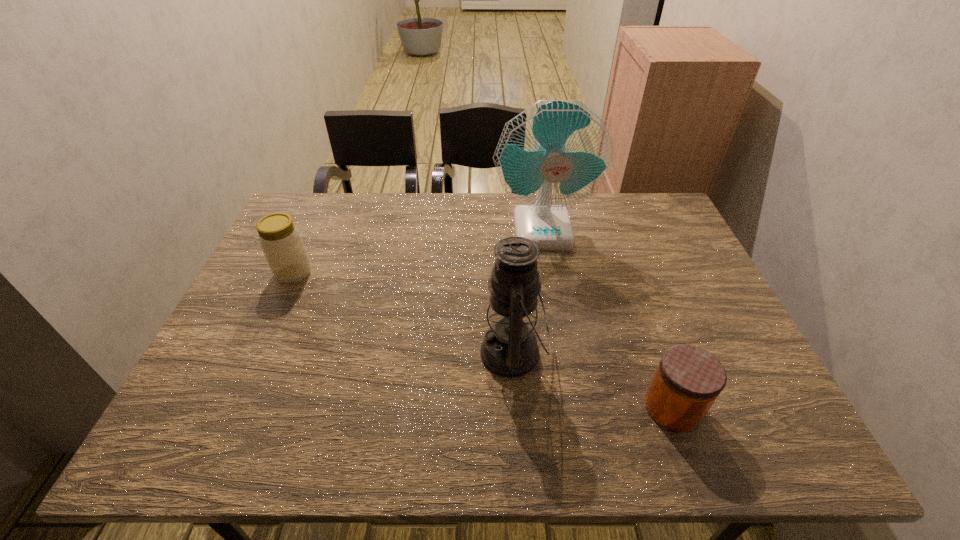
Find the location of a particular element. This screenshot has width=960, height=540. vacant space at the far right corner of the desktop is located at coordinates point(656,193).

You are a GUI agent. You are given a task and a screenshot of the screen. Output one action in this format:
    pyautogui.click(x=<x>, y=<y>)
    Task: Click on the vacant point located between the leftmost object and the oil lamp
    Image resolution: width=960 pixels, height=540 pixels.
    Given the screenshot: What is the action you would take?
    pyautogui.click(x=403, y=313)

The width and height of the screenshot is (960, 540). I want to click on vacant region between the second farthest object and the tallest object, so click(418, 251).

You are a GUI agent. You are given a task and a screenshot of the screen. Output one action in this format:
    pyautogui.click(x=<x>, y=<y>)
    Task: Click on the vacant area between the third tallest object and the third shortest object
    The image size is (960, 540).
    Given the screenshot: What is the action you would take?
    pyautogui.click(x=403, y=313)

Where is `free space between the third tallest object and the fan`? Image resolution: width=960 pixels, height=540 pixels. free space between the third tallest object and the fan is located at coordinates (418, 251).

The height and width of the screenshot is (540, 960). Find the location of `free space between the fan and the third nearest object`. free space between the fan and the third nearest object is located at coordinates (418, 251).

Image resolution: width=960 pixels, height=540 pixels. What are the coordinates of `vacant region between the nearer jar and the farthest object` in the screenshot? It's located at (608, 318).

Where is `object that stands as the closest to the oil lamp`? The height and width of the screenshot is (540, 960). object that stands as the closest to the oil lamp is located at coordinates (688, 380).

The image size is (960, 540). In order to click on the second closest object to the oil lamp in this screenshot , I will do `click(557, 153)`.

Find the location of `vacant space that satisfies the following two spatial constraints: 1. on the front side of the oil lamp; 2. on the right side of the shorter jar`. vacant space that satisfies the following two spatial constraints: 1. on the front side of the oil lamp; 2. on the right side of the shorter jar is located at coordinates (516, 408).